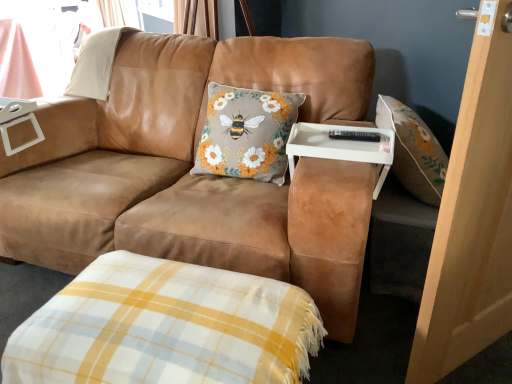
Question: Can you confirm if light brown wood screen door at right is shorter than white plastic tray at center?

Choices:
 (A) no
 (B) yes

Answer: (A)

Question: Is light brown wood screen door at right further to camera compared to white plastic tray at center?

Choices:
 (A) no
 (B) yes

Answer: (A)

Question: Considering the relative sizes of light brown wood screen door at right and white plastic tray at center in the image provided, is light brown wood screen door at right bigger than white plastic tray at center?

Choices:
 (A) yes
 (B) no

Answer: (A)

Question: Could you tell me if light brown wood screen door at right is facing white plastic tray at center?

Choices:
 (A) yes
 (B) no

Answer: (B)

Question: Does light brown wood screen door at right have a lesser width compared to white plastic tray at center?

Choices:
 (A) no
 (B) yes

Answer: (B)

Question: Visually, is white plastic tray at center positioned to the left or to the right of suede brown couch at center?

Choices:
 (A) left
 (B) right

Answer: (B)

Question: From the image's perspective, is white plastic tray at center above or below suede brown couch at center?

Choices:
 (A) above
 (B) below

Answer: (B)

Question: From their relative heights in the image, would you say white plastic tray at center is taller or shorter than suede brown couch at center?

Choices:
 (A) tall
 (B) short

Answer: (B)

Question: Considering the positions of point pos(300,125) and point pos(373,57), is point pos(300,125) closer or farther from the camera than point pos(373,57)?

Choices:
 (A) farther
 (B) closer

Answer: (B)

Question: In the image, is yellow and white plaid blanket at lower center on the left side or the right side of light brown wood screen door at right?

Choices:
 (A) right
 (B) left

Answer: (B)

Question: From the image's perspective, relative to light brown wood screen door at right, is yellow and white plaid blanket at lower center above or below?

Choices:
 (A) below
 (B) above

Answer: (A)

Question: Is yellow and white plaid blanket at lower center taller or shorter than light brown wood screen door at right?

Choices:
 (A) tall
 (B) short

Answer: (B)

Question: In the image, is yellow and white plaid blanket at lower center positioned in front of or behind light brown wood screen door at right?

Choices:
 (A) front
 (B) behind

Answer: (B)

Question: From a real-world perspective, is light brown wood screen door at right positioned above or below suede brown couch at center?

Choices:
 (A) below
 (B) above

Answer: (B)

Question: Do you think light brown wood screen door at right is within suede brown couch at center, or outside of it?

Choices:
 (A) inside
 (B) outside

Answer: (B)